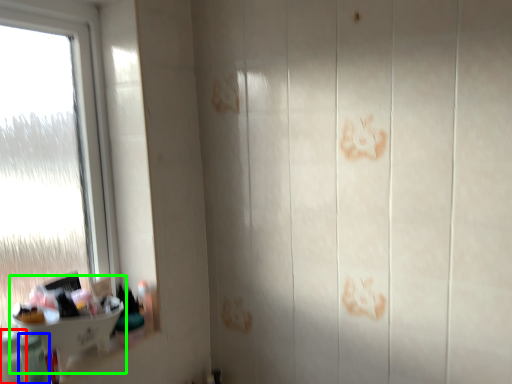
Question: Based on their relative distances, which object is farther from toiletry (highlighted by a red box)? Choose from toiletry (highlighted by a blue box) and sink (highlighted by a green box).

Choices:
 (A) toiletry
 (B) sink

Answer: (B)